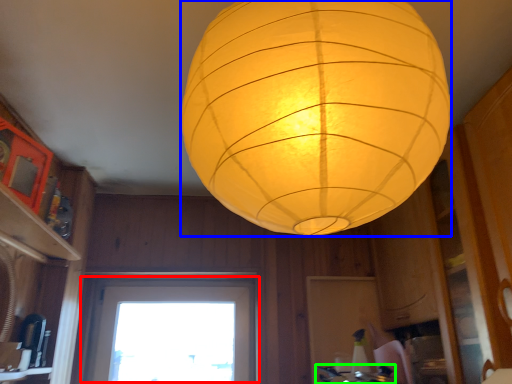
Question: Which object is positioned closest to window (highlighted by a red box)? Select from lantern (highlighted by a blue box) and gas stove (highlighted by a green box).

Choices:
 (A) lantern
 (B) gas stove

Answer: (B)